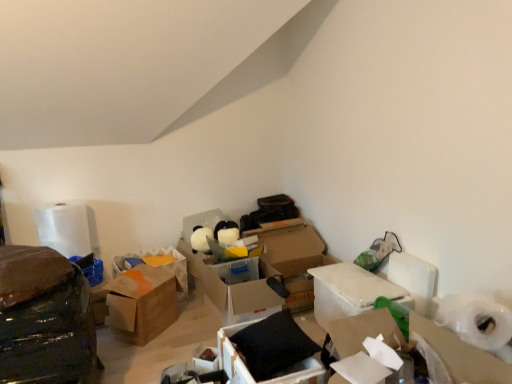
Question: Are black matte pillow at center, which is the 2th box in right-to-left order, and shiny black plastic bag at left located far from each other?

Choices:
 (A) no
 (B) yes

Answer: (A)

Question: Does black matte pillow at center, which is the 2th box in right-to-left order, come in front of shiny black plastic bag at left?

Choices:
 (A) no
 (B) yes

Answer: (A)

Question: From the image's perspective, is black matte pillow at center, the 4th box in the left-to-right sequence, over shiny black plastic bag at left?

Choices:
 (A) no
 (B) yes

Answer: (A)

Question: Does black matte pillow at center, which is the 2th box in right-to-left order, appear on the left side of shiny black plastic bag at left?

Choices:
 (A) yes
 (B) no

Answer: (B)

Question: Does black matte pillow at center, the 4th box in the left-to-right sequence, contain shiny black plastic bag at left?

Choices:
 (A) no
 (B) yes

Answer: (A)

Question: Considering the relative sizes of black matte pillow at center, which is the 2th box in right-to-left order, and shiny black plastic bag at left in the image provided, is black matte pillow at center, which is the 2th box in right-to-left order, bigger than shiny black plastic bag at left?

Choices:
 (A) yes
 (B) no

Answer: (B)

Question: From a real-world perspective, is white cardboard box at center-right, which appears as the fifth box when viewed from the left, beneath brown cardboard box at center, which is the 5th box in right-to-left order?

Choices:
 (A) no
 (B) yes

Answer: (B)

Question: Is white cardboard box at center-right, which is the 1th box from right to left, looking in the opposite direction of brown cardboard box at center, which is the 5th box in right-to-left order?

Choices:
 (A) yes
 (B) no

Answer: (B)

Question: Is white cardboard box at center-right, which appears as the fifth box when viewed from the left, shorter than brown cardboard box at center, which is the 5th box in right-to-left order?

Choices:
 (A) yes
 (B) no

Answer: (B)

Question: Can you confirm if white cardboard box at center-right, which appears as the fifth box when viewed from the left, is smaller than brown cardboard box at center, which is the 5th box in right-to-left order?

Choices:
 (A) no
 (B) yes

Answer: (A)

Question: Can you confirm if white cardboard box at center-right, which is the 1th box from right to left, is bigger than brown cardboard box at center, which is the 5th box in right-to-left order?

Choices:
 (A) no
 (B) yes

Answer: (B)

Question: Considering the relative sizes of white cardboard box at center-right, which appears as the fifth box when viewed from the left, and brown cardboard box at center, the 1th box when ordered from left to right, in the image provided, is white cardboard box at center-right, which appears as the fifth box when viewed from the left, taller than brown cardboard box at center, the 1th box when ordered from left to right,?

Choices:
 (A) no
 (B) yes

Answer: (B)

Question: Is black matte pillow at center, which is the 2th box in right-to-left order, shorter than brown cardboard box at center, placed as the 4th box when sorted from right to left?

Choices:
 (A) yes
 (B) no

Answer: (A)